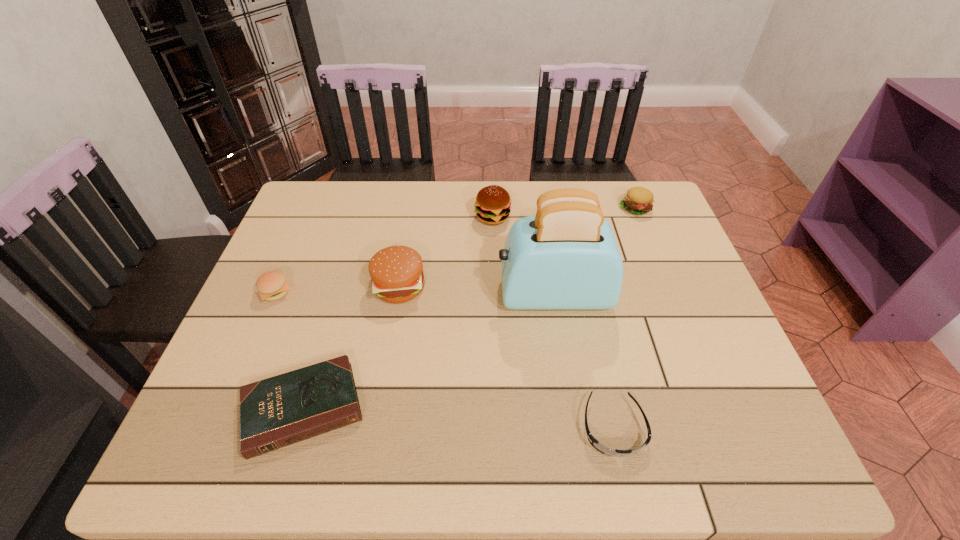
What are the coordinates of `free region that satisfies the following two spatial constraints: 1. on the back side of the rightmost object; 2. on the left side of the second hamburger from left to right` in the screenshot? It's located at (413, 208).